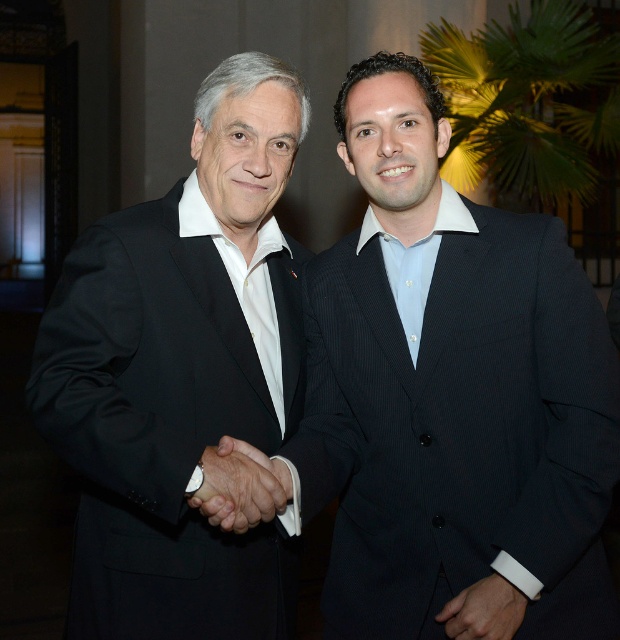
From the picture: You are a photographer at a formal event and notice the black matte suit at left and the white leather wristband at center. Which object is located to the left of the other?

The black matte suit at left is positioned on the left side of white leather wristband at center.

You are a photographer adjusting the lighting for a portrait of the two men shaking hands. You need to ensure both the black matte hand at center and the white leather wristband at center are clearly visible. Which object requires more focused lighting to avoid being lost in the shadows?

The white leather wristband at center requires more focused lighting because it is narrower than the black matte hand at center and may blend into the background if not properly illuminated.